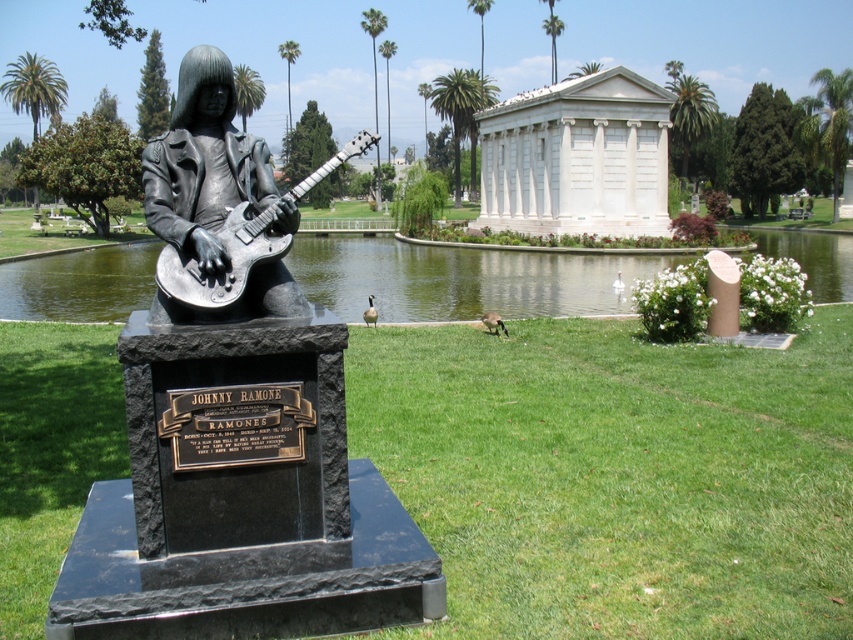
Based on the photo, you are a photographer aiming to capture both the polished silver guitar at center and the shiny metallic guitar at center in a single shot. Which guitar should you position closer to the left side of your camera frame to ensure both are visible?

You should position the polished silver guitar at center closer to the left side of your camera frame since it is already to the left of the shiny metallic guitar at center, ensuring both are captured in the shot.

You are standing at the point marked as point (460,280) in the park. What is the terrain like under your feet?

The point (460,280) is on green water at center, so the terrain under your feet is water.

You are standing in the park and want to take a photo of the statue of the rock musician. If you move 10 meters closer to the point at coordinates point (605, 289), will you be closer to the statue than before?

The point at coordinates point (605, 289) is 26.54 meters from the viewer. Moving 10 meters closer would bring you to 16.54 meters away, so yes, you will be closer to the statue than before.